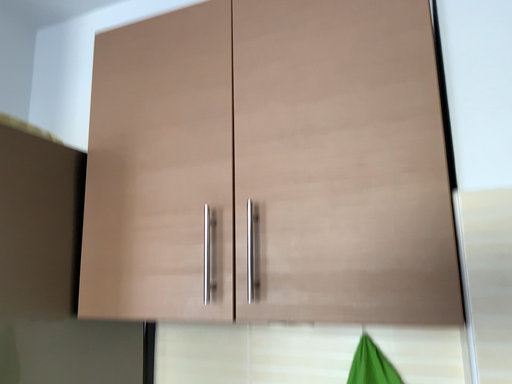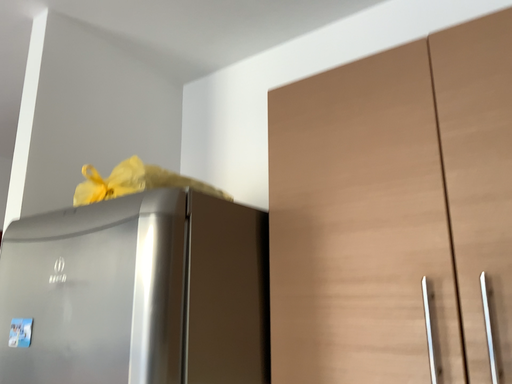
Question: Which way did the camera rotate in the video?

Choices:
 (A) rotated right
 (B) rotated left

Answer: (B)